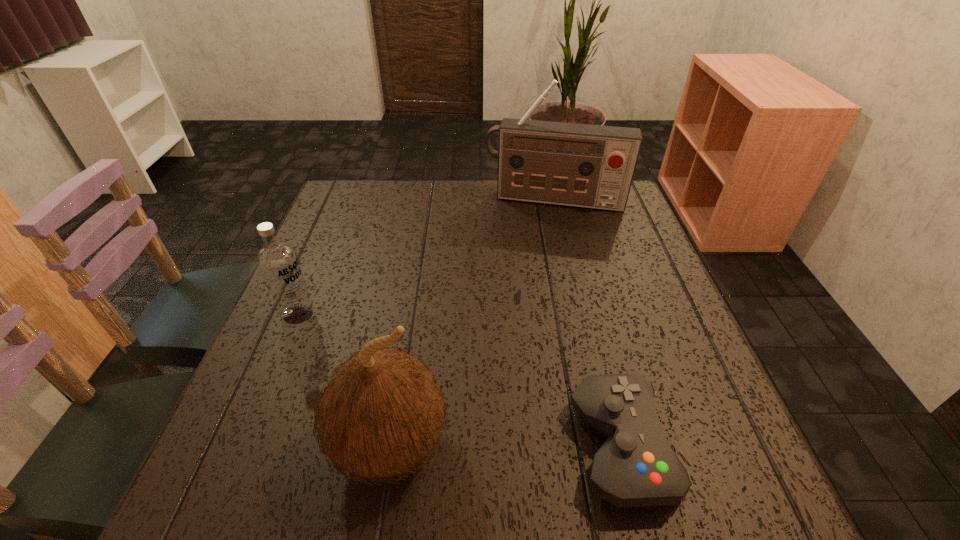
This screenshot has width=960, height=540. What are the coordinates of `free space on the desktop that is between the third shortest object and the shortest object and is positioned on the front label of the second shortest object` in the screenshot? It's located at [510, 446].

The height and width of the screenshot is (540, 960). Find the location of `vacant space on the desktop that is between the third shortest object and the control and is positioned on the front panel of the radio receiver`. vacant space on the desktop that is between the third shortest object and the control and is positioned on the front panel of the radio receiver is located at coordinates (521, 446).